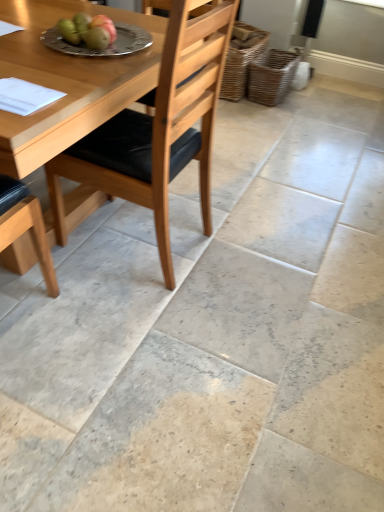
Identify the location of vacant area that lies to the right of white paper at upper left. This screenshot has height=512, width=384. (74, 99).